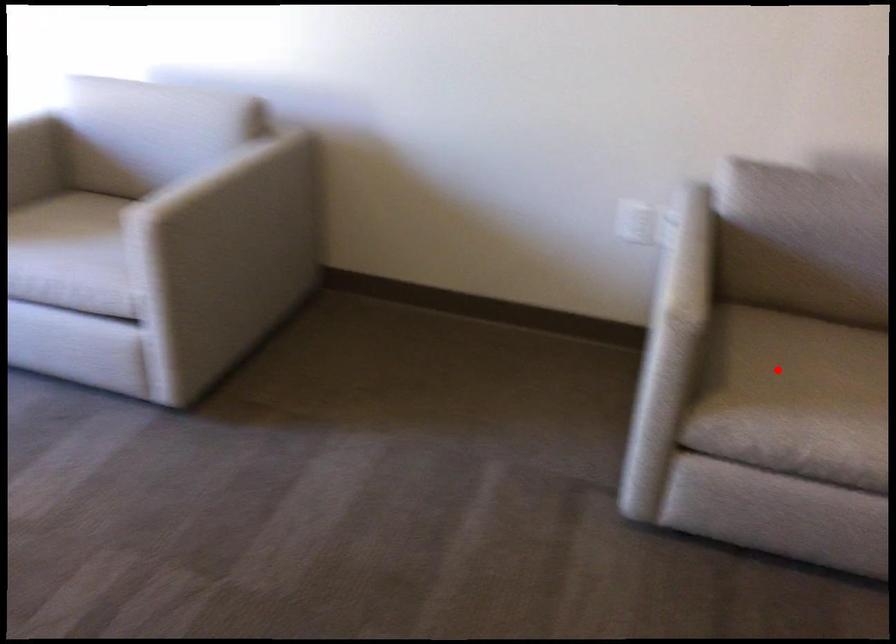
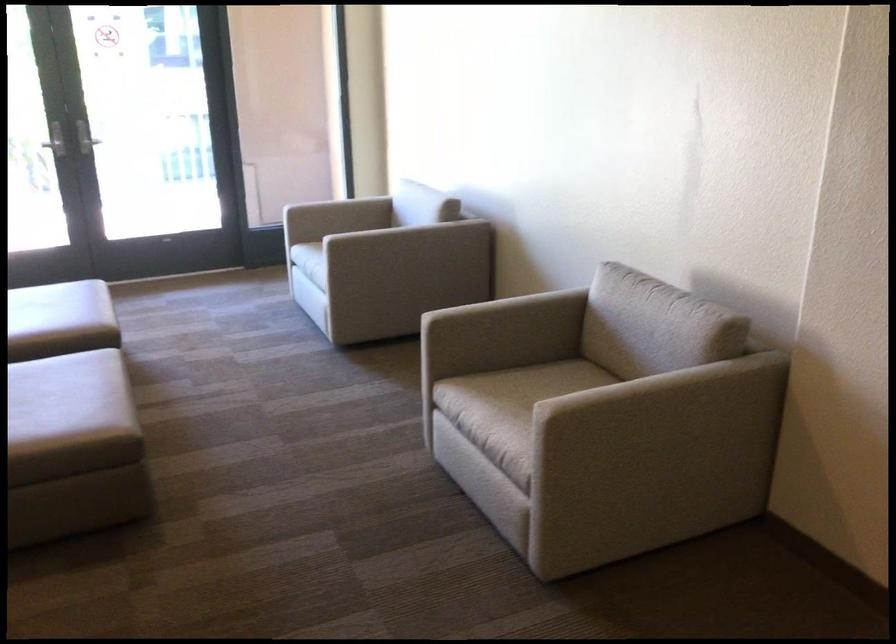
Where in the second image is the point corresponding to the highlighted location from the first image?

(513, 389)